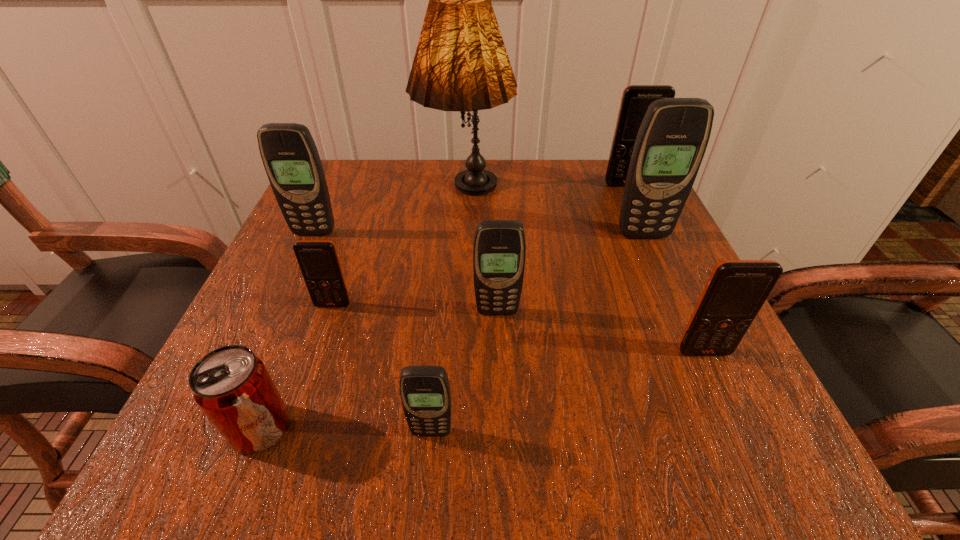
Find the location of a particular element. The height and width of the screenshot is (540, 960). free space located on the screen of the third biggest gray cellular telephone is located at coordinates (500, 390).

Where is `free space located 0.160m on the screen of the nearest orange cellular telephone`? Image resolution: width=960 pixels, height=540 pixels. free space located 0.160m on the screen of the nearest orange cellular telephone is located at coordinates (756, 463).

Locate an element on the screen. This screenshot has width=960, height=540. free space located 0.050m on the screen of the second cellular telephone from left to right is located at coordinates (324, 332).

This screenshot has width=960, height=540. Identify the location of free point located on the right of the pop soda. (565, 428).

Locate an element on the screen. lampshade that is positioned at the far edge is located at coordinates (461, 64).

Find the location of `cellular telephone that is at the far edge`. cellular telephone that is at the far edge is located at coordinates (636, 99).

Identify the location of cellular telephone that is positioned at the near edge. The width and height of the screenshot is (960, 540). (425, 393).

Where is `pop soda located in the near edge section of the desktop`? pop soda located in the near edge section of the desktop is located at coordinates (231, 385).

You are a GUI agent. You are given a task and a screenshot of the screen. Output one action in this format:
    pyautogui.click(x=<x>, y=<y>)
    Task: Click on the pop soda at the left edge
    
    Given the screenshot: What is the action you would take?
    pyautogui.click(x=231, y=385)

You are a GUI agent. You are given a task and a screenshot of the screen. Output one action in this format:
    pyautogui.click(x=<x>, y=<y>)
    Task: Click on the object that is at the near left corner
    This screenshot has width=960, height=540.
    Given the screenshot: What is the action you would take?
    pyautogui.click(x=231, y=385)